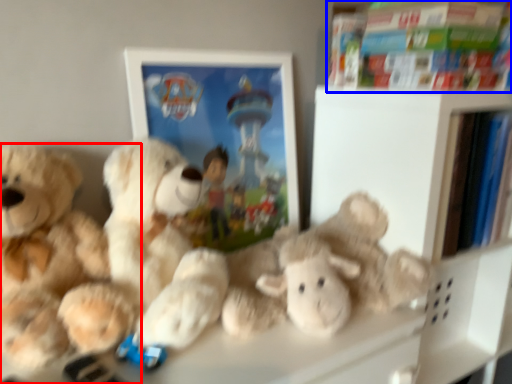
Question: Among these objects, which one is farthest to the camera, teddy bear (highlighted by a red box) or book (highlighted by a blue box)?

Choices:
 (A) teddy bear
 (B) book

Answer: (B)